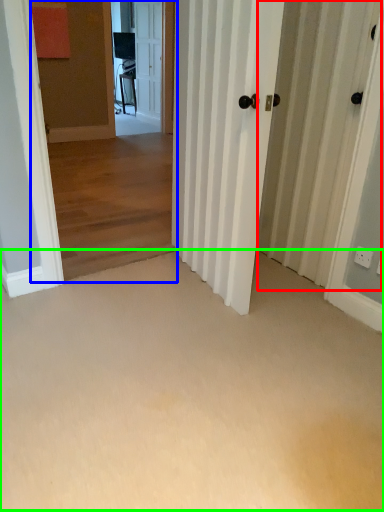
Question: Estimate the real-world distances between objects in this image. Which object is closer to barn door (highlighted by a red box), corridor (highlighted by a blue box) or corridor (highlighted by a green box)?

Choices:
 (A) corridor
 (B) corridor

Answer: (B)